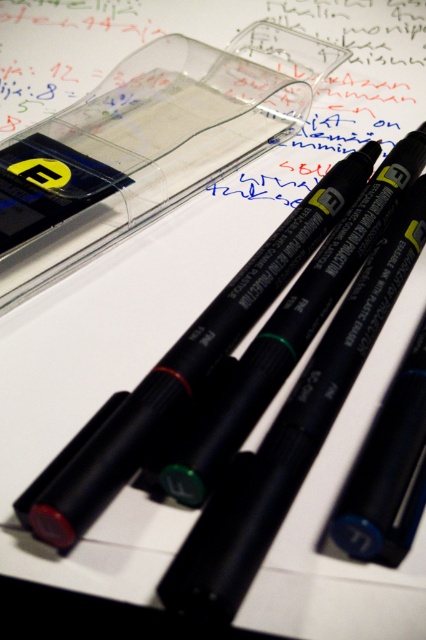
You are organizing a stationery set and need to place the matte black pen at center and the rubber eraser at lower left into a vertical storage container. The container has a height limit of 10 cm. Can both items fit vertically without exceeding the height limit?

The matte black pen at center is taller than the rubber eraser at lower left. Since the container has a height limit of 10 cm, we need to know the exact height of the pen. However, the description only states that the pen is taller than the eraser. Without specific measurements, we cannot confirm if the pen exceeds 10 cm. Therefore, it is uncertain if both items will fit vertically within the container.

You are holding a camera and want to take a photo of the matte black pen at center. If the camera can focus on objects within 24 inches, will it be able to capture a clear image of the pen?

The matte black pen at center and camera are 22.29 inches apart from each other, so yes, the camera can focus and capture a clear image since the distance is within the 24 inches range.

You are organizing your desk and need to place the matte black pen at center and the rubber eraser at lower left into their respective storage spots. The pen goes into a slot on the right side of your desk organizer, and the eraser goes into a slot on the left. Based on their current positions, which item is closer to its designated storage spot?

The rubber eraser at lower left is closer to its designated storage spot on the left because it is already positioned to the left of the matte black pen at center.